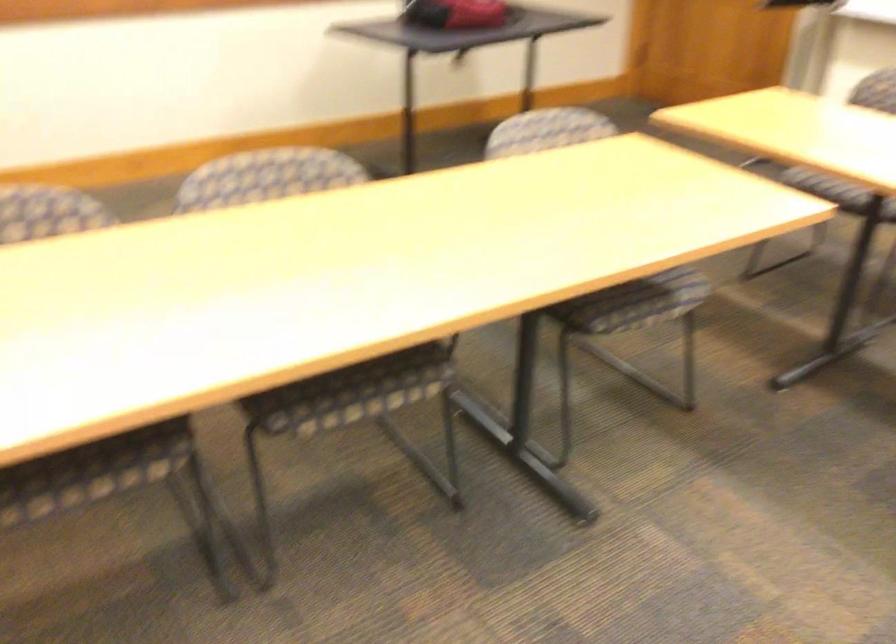
Which object does [455,13] point to?

It refers to a red and black bag.